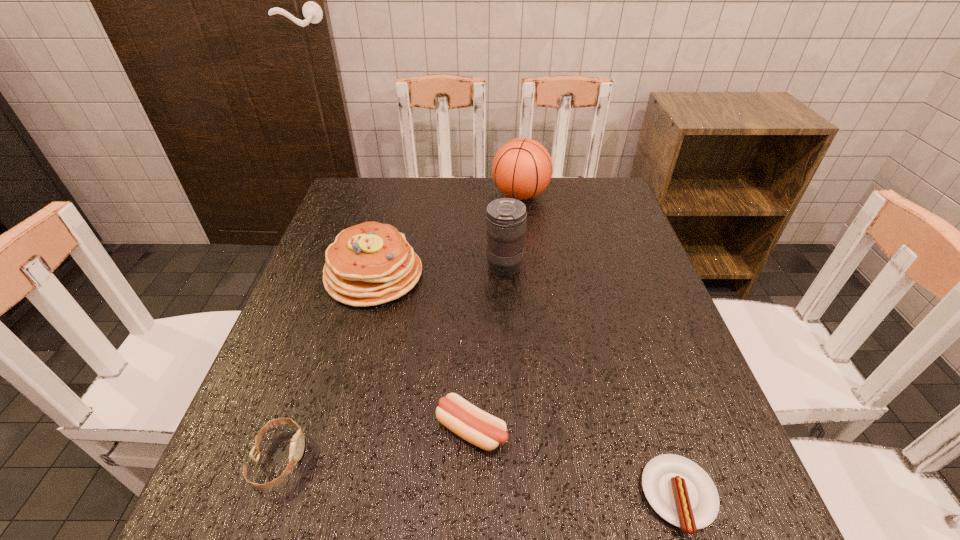
The image size is (960, 540). Identify the location of vacant area that lies between the left sausage and the telephoto lens. (488, 348).

At what (x,y) coordinates should I click in order to perform the action: click on free space between the watch and the pancake. Please return your answer as a coordinate pair (x, y). The height and width of the screenshot is (540, 960). Looking at the image, I should click on (326, 367).

Locate an element on the screen. The height and width of the screenshot is (540, 960). free space between the shorter sausage and the watch is located at coordinates (479, 477).

The width and height of the screenshot is (960, 540). In order to click on free point between the basketball and the pancake in this screenshot , I will do `click(447, 235)`.

I want to click on free space between the basketball and the left sausage, so click(x=496, y=313).

I want to click on vacant area that lies between the farthest object and the watch, so click(399, 327).

Identify which object is the second nearest to the third tallest object. Please provide its 2D coordinates. Your answer should be formatted as a tuple, i.e. [(x, y)], where the tuple contains the x and y coordinates of a point satisfying the conditions above.

[(522, 168)]

Where is `the fifth closest object to the fourth shortest object`? the fifth closest object to the fourth shortest object is located at coordinates pos(679,490).

Identify the location of free point that satisfies the following two spatial constraints: 1. on the back side of the farthest object; 2. on the left side of the third tallest object. (396, 195).

This screenshot has width=960, height=540. I want to click on blank area in the image that satisfies the following two spatial constraints: 1. on the face of the watch; 2. on the left side of the shorter sausage, so click(x=266, y=496).